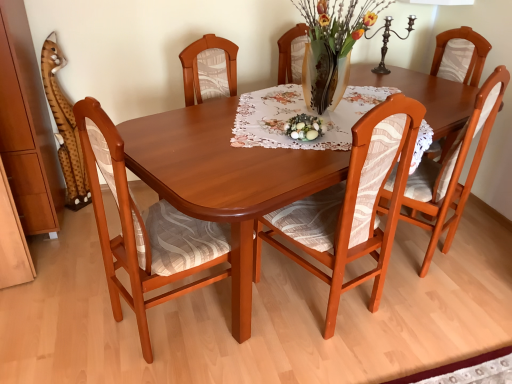
Where is `free space on the front side of matte wood chair at center, arranged as the first chair when viewed from the right`? free space on the front side of matte wood chair at center, arranged as the first chair when viewed from the right is located at coordinates (439, 307).